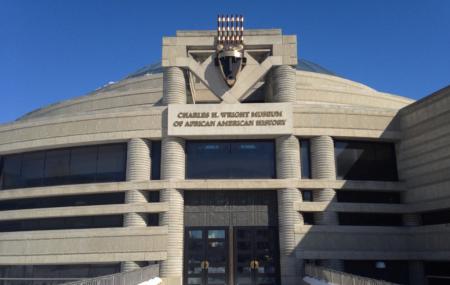
This screenshot has width=450, height=285. I want to click on pillars, so click(170, 159), click(141, 160), click(289, 166), click(325, 159).